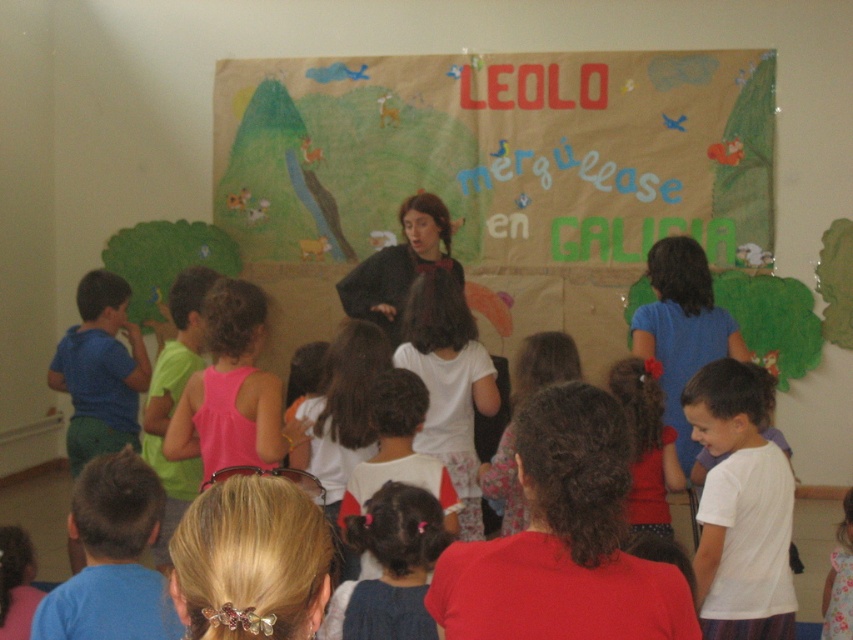
Can you confirm if brown paper banner at center is positioned to the right of matte black sweater at center?

Yes, brown paper banner at center is to the right of matte black sweater at center.

Does brown paper banner at center have a lesser height compared to matte black sweater at center?

No, brown paper banner at center is not shorter than matte black sweater at center.

What do you see at coordinates (498, 154) in the screenshot?
I see `brown paper banner at center` at bounding box center [498, 154].

Where is `brown paper banner at center`? The image size is (853, 640). brown paper banner at center is located at coordinates (498, 154).